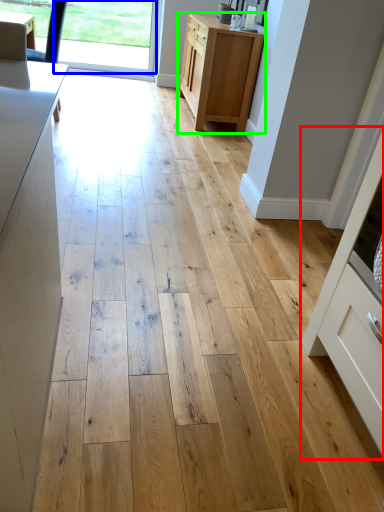
Question: Which object is the closest to the cabinetry (highlighted by a red box)? Choose among these: window screen (highlighted by a blue box) or cabinetry (highlighted by a green box).

Choices:
 (A) window screen
 (B) cabinetry

Answer: (B)